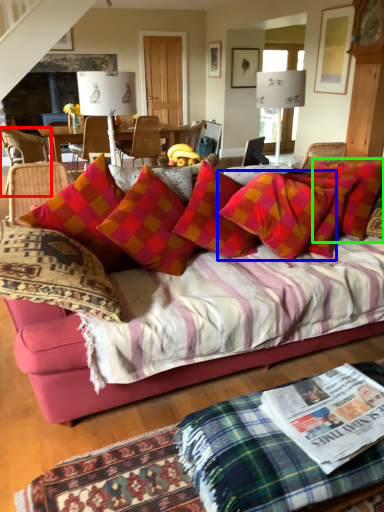
Question: Which is nearer to the chair (highlighted by a red box)? pillow (highlighted by a blue box) or pillow (highlighted by a green box).

Choices:
 (A) pillow
 (B) pillow

Answer: (A)